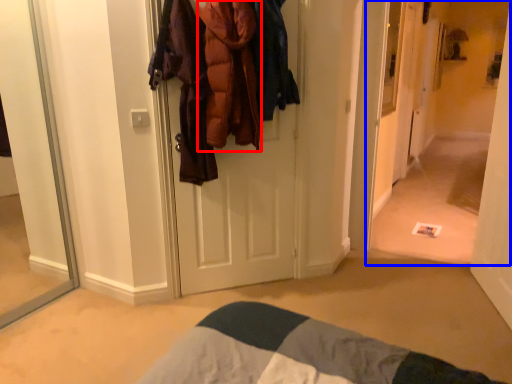
Question: Which object appears closest to the camera in this image, clothing (highlighted by a red box) or corridor (highlighted by a blue box)?

Choices:
 (A) clothing
 (B) corridor

Answer: (A)